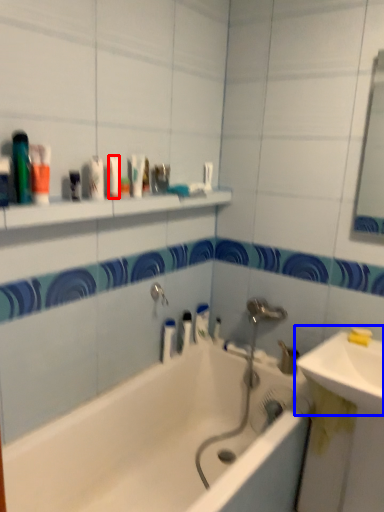
Question: Which object is further to the camera taking this photo, mouthwash (highlighted by a red box) or sink (highlighted by a blue box)?

Choices:
 (A) mouthwash
 (B) sink

Answer: (A)